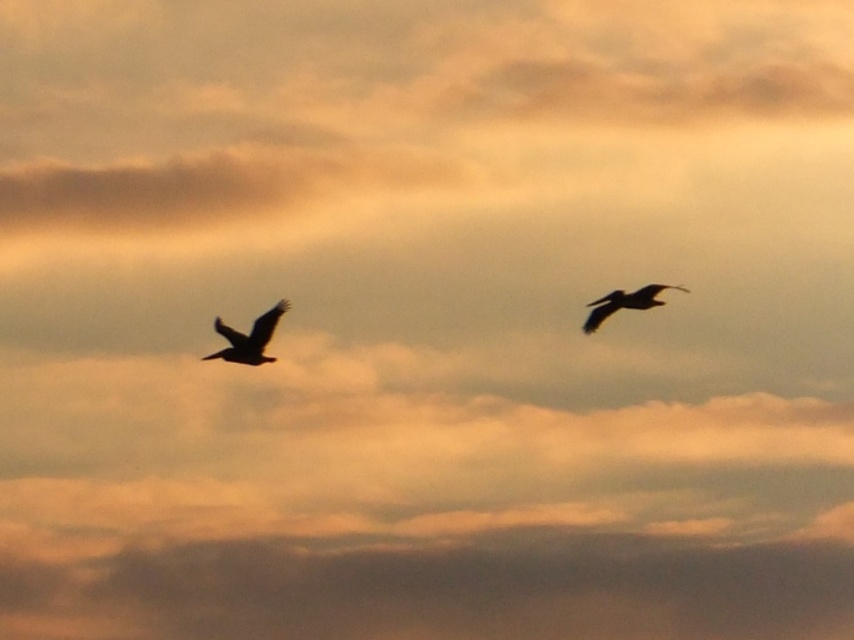
Does silhouette feathered bird at left appear on the right side of dark feathered bird at upper right?

No, silhouette feathered bird at left is not to the right of dark feathered bird at upper right.

Does silhouette feathered bird at left have a greater height compared to dark feathered bird at upper right?

Yes.

Does point (285, 305) lie in front of point (629, 298)?

No, (285, 305) is behind (629, 298).

This screenshot has width=854, height=640. What are the coordinates of `silhouette feathered bird at left` in the screenshot? It's located at (249, 337).